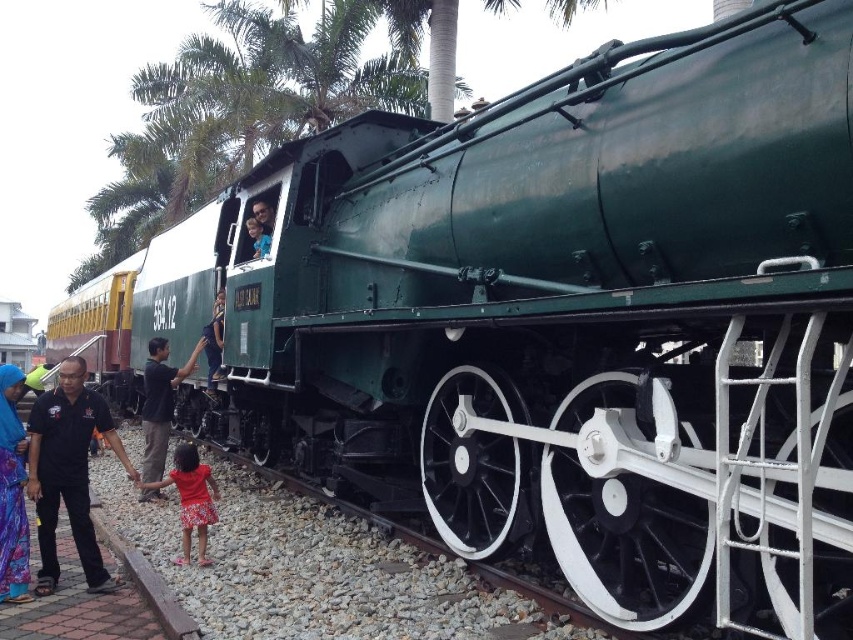
Question: Does red floral dress at lower left appear under blue fabric shirt at center?

Choices:
 (A) yes
 (B) no

Answer: (A)

Question: Which of the following is the closest to the observer?

Choices:
 (A) metallic green train at center
 (B) black shirt at left

Answer: (B)

Question: Which point appears farthest from the camera in this image?

Choices:
 (A) (158, 368)
 (B) (32, 438)

Answer: (A)

Question: Does printed fabric dress at lower left have a lesser width compared to red floral dress at lower left?

Choices:
 (A) no
 (B) yes

Answer: (B)

Question: Does black shirt at left have a lesser width compared to metallic green train at center?

Choices:
 (A) no
 (B) yes

Answer: (A)

Question: Which point is farther to the camera?

Choices:
 (A) black shirt at left
 (B) red floral dress at lower left
 (C) blue fabric shirt at center
 (D) metallic green train at center

Answer: (D)